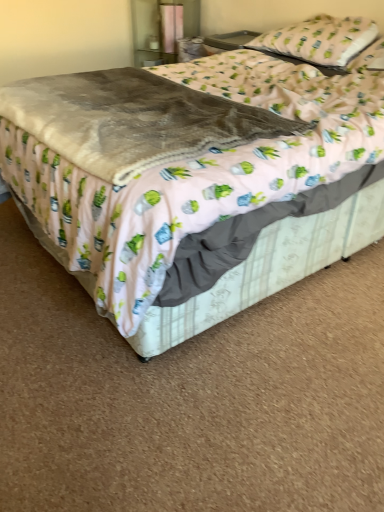
Question: In the image, is velvety gray blanket at center positioned in front of or behind white fabric pillow at upper right, which is counted as the second pillow, starting from the top?

Choices:
 (A) behind
 (B) front

Answer: (B)

Question: In terms of height, does velvety gray blanket at center look taller or shorter compared to white fabric pillow at upper right, positioned as the 1th pillow in bottom-to-top order?

Choices:
 (A) short
 (B) tall

Answer: (B)

Question: Based on their relative distances, which object is nearer to the velvet gray blanket at center?

Choices:
 (A) white fabric pillow at upper right, acting as the first pillow starting from the top
 (B) white fabric pillow at upper right, positioned as the 1th pillow in bottom-to-top order
 (C) velvety gray blanket at center

Answer: (C)

Question: Which object is positioned farthest from the velvety gray blanket at center?

Choices:
 (A) velvet gray blanket at center
 (B) white fabric pillow at upper right, positioned as the 1th pillow in bottom-to-top order
 (C) white fabric pillow at upper right, the second pillow ordered from the bottom

Answer: (B)